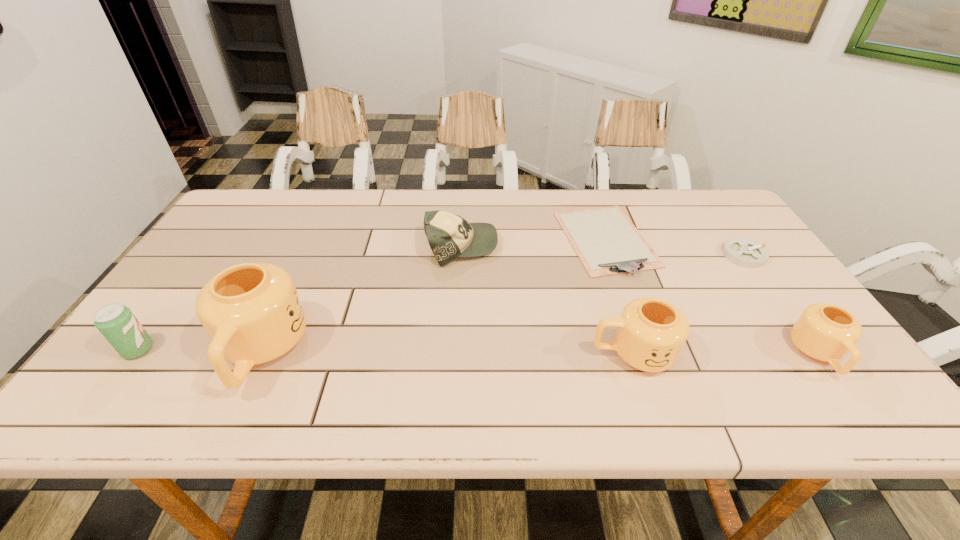
Identify the location of vacant region between the shortest mug and the ashtray. (781, 305).

The image size is (960, 540). What are the coordinates of `free space between the clipboard and the second shortest object` in the screenshot? It's located at (675, 247).

At what (x,y) coordinates should I click in order to perform the action: click on empty location between the shortest mug and the soda. Please return your answer as a coordinate pair (x, y). Image resolution: width=960 pixels, height=540 pixels. Looking at the image, I should click on (478, 352).

The width and height of the screenshot is (960, 540). I want to click on free space between the sixth object from right to left and the second tallest mug, so click(x=447, y=353).

Where is `free area in between the third object from left to right and the second tallest mug`? This screenshot has height=540, width=960. free area in between the third object from left to right and the second tallest mug is located at coordinates (547, 300).

Locate an element on the screen. vacant area between the sixth object from right to left and the second mug from left to right is located at coordinates [x=447, y=353].

The width and height of the screenshot is (960, 540). Identify the location of free space between the shortest object and the second mug from right to left. (619, 296).

Identify the location of object that ranks as the fifth closest to the second mug from right to left. (252, 313).

This screenshot has height=540, width=960. What are the coordinates of `object that is the fourth closest one to the rightmost mug` in the screenshot? It's located at click(450, 236).

Select which mug is the second closest to the shortest mug. Please provide its 2D coordinates. Your answer should be formatted as a tuple, i.e. [(x, y)], where the tuple contains the x and y coordinates of a point satisfying the conditions above.

[(252, 313)]